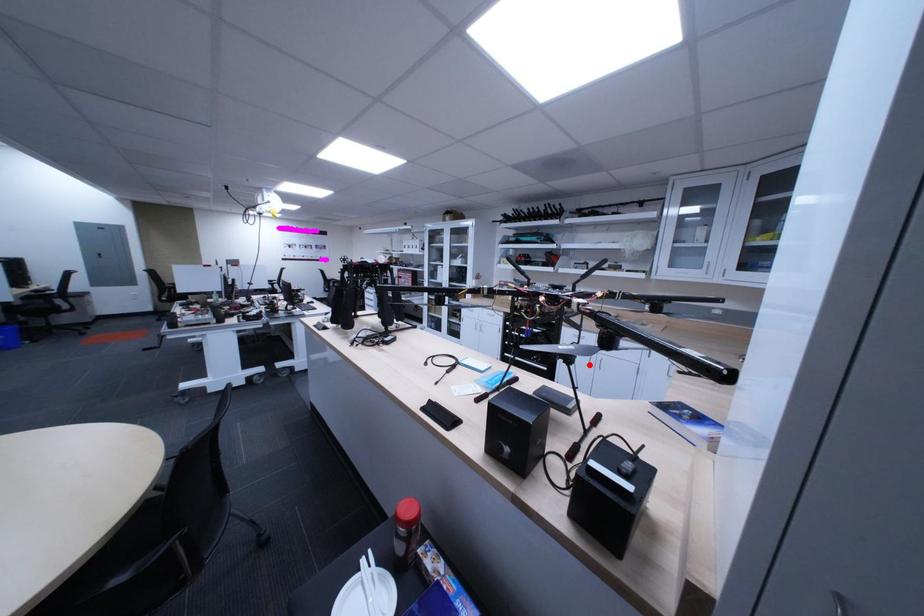
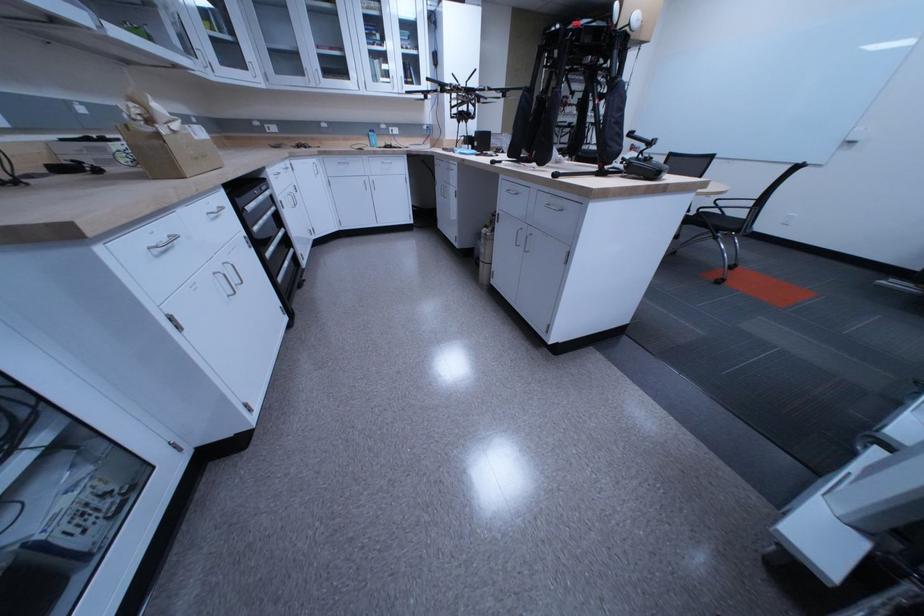
Question: I am providing you with two images of the same scene from different viewpoints. A red point is marked on the first image. Is the red point's position out of view in image 2?

Choices:
 (A) Yes
 (B) No

Answer: (A)